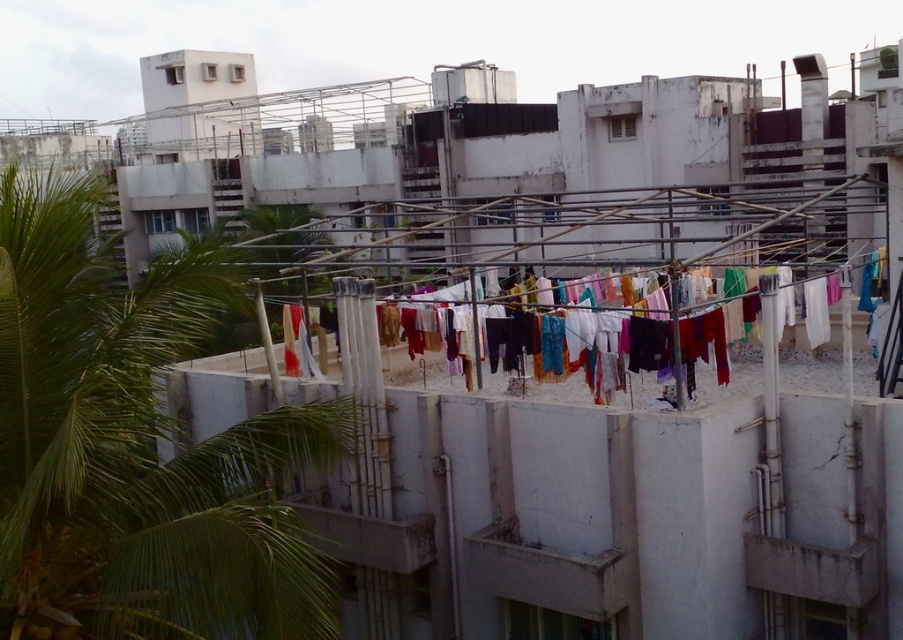
Question: Which object appears closest to the camera in this image?

Choices:
 (A) green leafy palm tree at upper left
 (B) multicolored fabric at center

Answer: (A)

Question: Which object is closer to the camera taking this photo?

Choices:
 (A) multicolored fabric at center
 (B) green leafy palm tree at upper left

Answer: (B)

Question: Is green leafy palm tree at upper left closer to camera compared to multicolored fabric at center?

Choices:
 (A) yes
 (B) no

Answer: (A)

Question: Considering the relative positions of green leafy palm tree at upper left and multicolored fabric at center in the image provided, where is green leafy palm tree at upper left located with respect to multicolored fabric at center?

Choices:
 (A) right
 (B) left

Answer: (B)

Question: Which point is farther to the camera?

Choices:
 (A) (79, 442)
 (B) (725, 396)

Answer: (B)

Question: Can you confirm if green leafy palm tree at upper left is bigger than multicolored fabric at center?

Choices:
 (A) yes
 (B) no

Answer: (A)